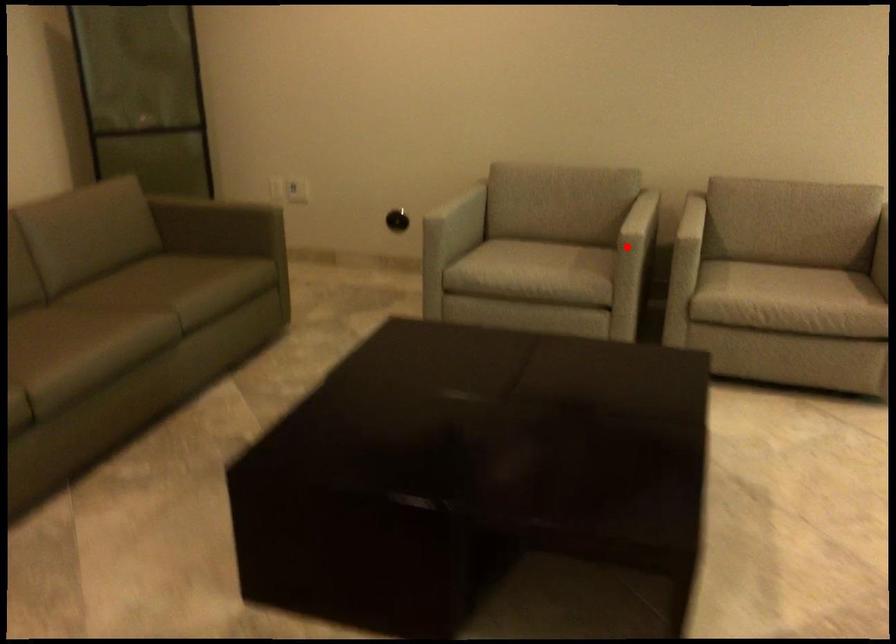
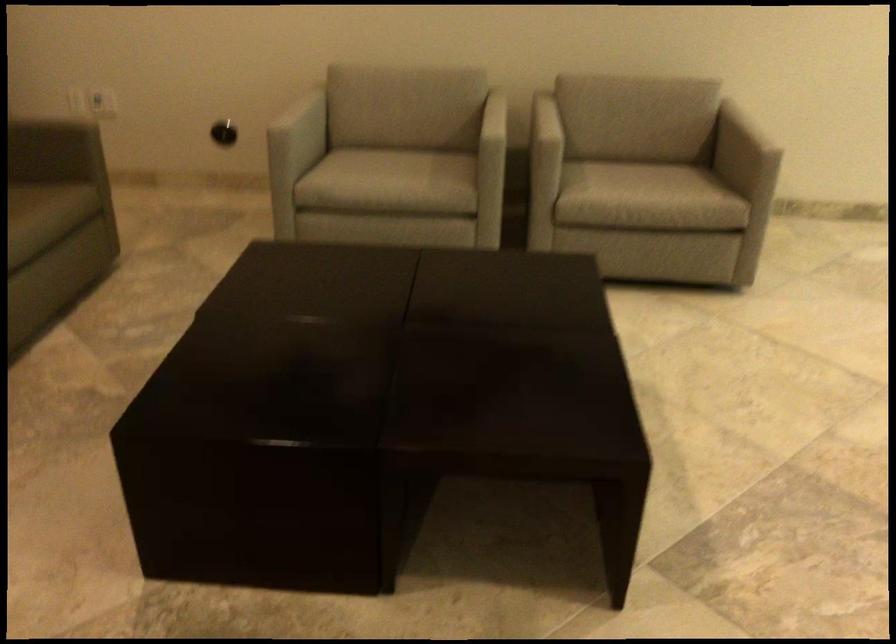
Find the pixel in the second image that matches the highlighted location in the first image.

(492, 151)